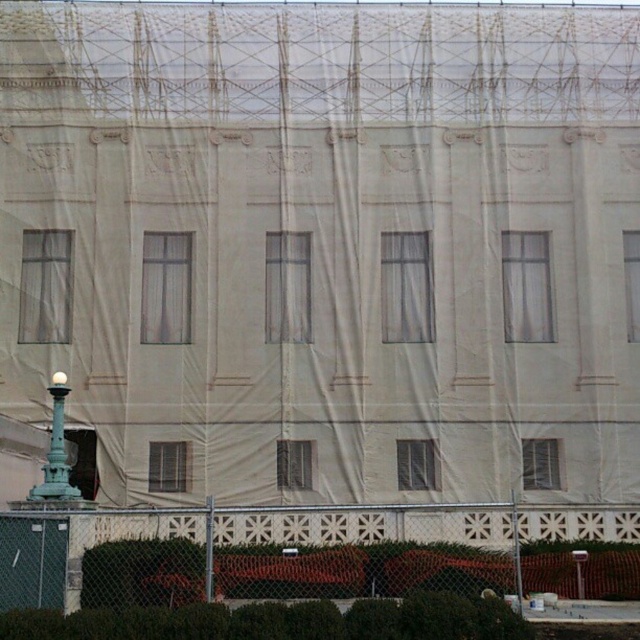
Question: Which object appears farthest from the camera in this image?

Choices:
 (A) green patinated metal lamp post at lower left
 (B) metal chain-link fence at lower center

Answer: (A)

Question: Does metal chain-link fence at lower center have a smaller size compared to green patinated metal lamp post at lower left?

Choices:
 (A) no
 (B) yes

Answer: (A)

Question: Where is metal chain-link fence at lower center located in relation to green patinated metal lamp post at lower left in the image?

Choices:
 (A) above
 (B) below

Answer: (B)

Question: Which of the following is the farthest from the observer?

Choices:
 (A) metal chain-link fence at lower center
 (B) green patinated metal lamp post at lower left

Answer: (B)

Question: Is metal chain-link fence at lower center smaller than green patinated metal lamp post at lower left?

Choices:
 (A) no
 (B) yes

Answer: (A)